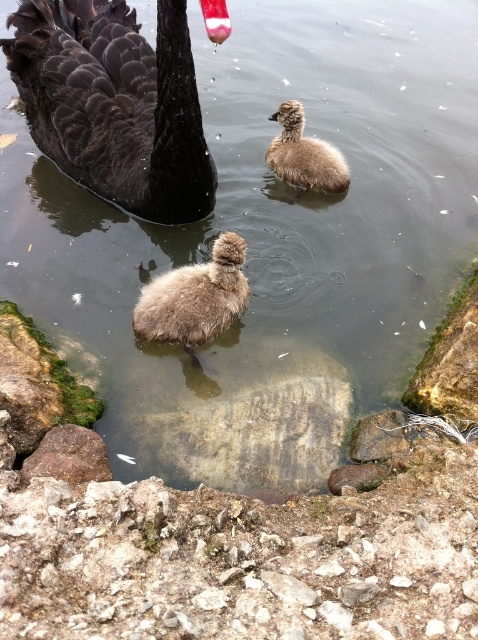
Who is positioned more to the left, shiny black swan at upper left or brown fluffy duckling at center?

From the viewer's perspective, shiny black swan at upper left appears more on the left side.

At what (x,y) coordinates should I click in order to perform the action: click on shiny black swan at upper left. Please return your answer as a coordinate pair (x, y). The width and height of the screenshot is (478, 640). Looking at the image, I should click on (115, 102).

Can you confirm if shiny black swan at upper left is wider than fuzzy brown duckling at center?

Yes, shiny black swan at upper left is wider than fuzzy brown duckling at center.

Who is lower down, shiny black swan at upper left or fuzzy brown duckling at center?

Positioned lower is fuzzy brown duckling at center.

Which is in front, point (162, 3) or point (172, 339)?

Point (162, 3)

Where is `shiny black swan at upper left`? Image resolution: width=478 pixels, height=640 pixels. shiny black swan at upper left is located at coordinates (115, 102).

Is fuzzy brown duckling at center taller than brown fluffy duckling at center?

Yes.

Does fuzzy brown duckling at center have a lesser width compared to brown fluffy duckling at center?

No.

Does point (236, 301) lie in front of point (296, 134)?

Yes, it is.

The width and height of the screenshot is (478, 640). I want to click on fuzzy brown duckling at center, so click(x=195, y=298).